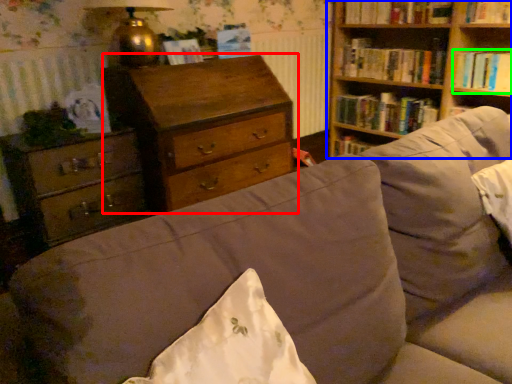
Question: Estimate the real-world distances between objects in this image. Which object is farther from chest of drawers (highlighted by a red box), bookcase (highlighted by a blue box) or book (highlighted by a green box)?

Choices:
 (A) bookcase
 (B) book

Answer: (B)